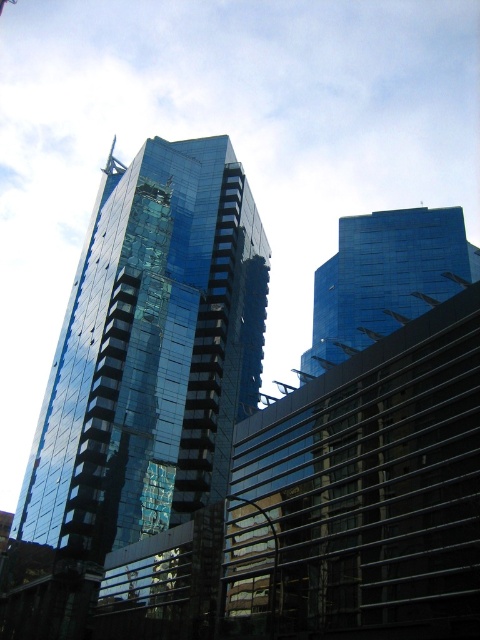
Between glossy glass building at center and glossy glass building at upper center, which one appears on the right side from the viewer's perspective?

Positioned to the right is glossy glass building at upper center.

Can you confirm if glossy glass building at center is taller than glossy glass building at upper center?

Yes.

At what (x,y) coordinates should I click in order to perform the action: click on glossy glass building at center. Please return your answer as a coordinate pair (x, y). This screenshot has width=480, height=640. Looking at the image, I should click on (140, 376).